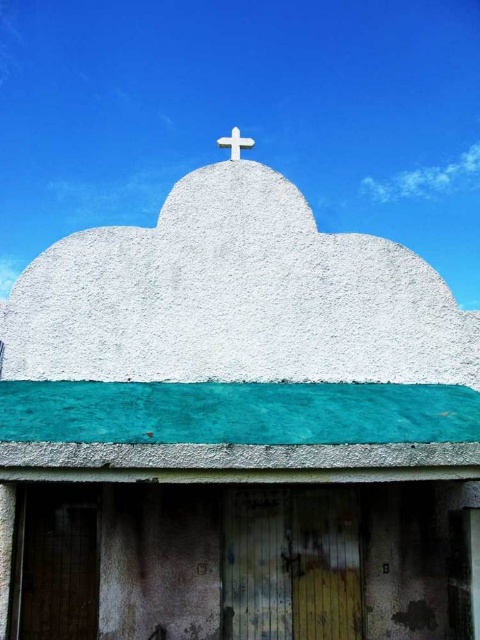
Question: Where is white rough concrete cloud at upper left located in relation to white stone cross at upper center in the image?

Choices:
 (A) right
 (B) left

Answer: (B)

Question: Does white fluffy cloud at upper center have a smaller size compared to white stone cross at upper center?

Choices:
 (A) no
 (B) yes

Answer: (B)

Question: Which object appears farthest from the camera in this image?

Choices:
 (A) white fluffy cloud at upper center
 (B) white stone cross at upper center
 (C) white rough concrete cloud at upper left

Answer: (A)

Question: Which object appears closest to the camera in this image?

Choices:
 (A) white stone cross at upper center
 (B) white rough concrete cloud at upper left

Answer: (B)

Question: Can you confirm if white fluffy cloud at upper center is thinner than white stone cross at upper center?

Choices:
 (A) yes
 (B) no

Answer: (B)

Question: Which object is positioned farthest from the white rough concrete cloud at upper left?

Choices:
 (A) white stone cross at upper center
 (B) white fluffy cloud at upper center

Answer: (B)